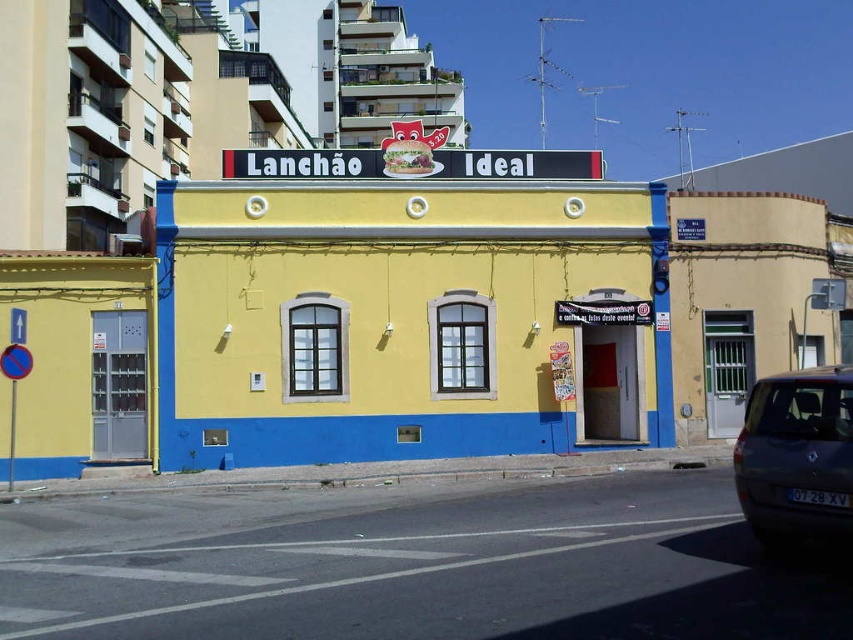
Who is more forward, (521, 289) or (798, 497)?

Positioned in front is point (798, 497).

Does yellow matte building at center lie behind dark gray metallic car at lower right?

Yes.

Is point (450, 221) less distant than point (758, 445)?

No, (450, 221) is behind (758, 445).

Where is `yellow matte building at center`? The width and height of the screenshot is (853, 640). yellow matte building at center is located at coordinates (408, 316).

Can you confirm if yellow matte building at center is positioned below yellow matte door at lower left?

Incorrect, yellow matte building at center is not positioned below yellow matte door at lower left.

Between point (395, 422) and point (73, 344), which one is positioned in front?

Point (73, 344)

Locate an element on the screen. yellow matte building at center is located at coordinates (408, 316).

Consider the image. Can you confirm if yellow matte door at lower left is shorter than dark gray metallic car at lower right?

In fact, yellow matte door at lower left may be taller than dark gray metallic car at lower right.

Locate an element on the screen. This screenshot has height=640, width=853. yellow matte door at lower left is located at coordinates (76, 362).

Image resolution: width=853 pixels, height=640 pixels. What are the coordinates of `yellow matte door at lower left` in the screenshot? It's located at (76, 362).